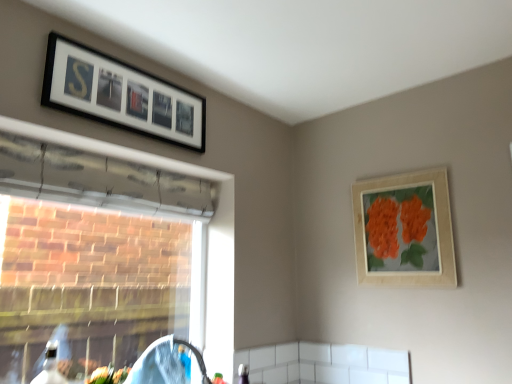
This screenshot has width=512, height=384. Describe the element at coordinates (207, 234) in the screenshot. I see `transparent plastic window at left` at that location.

What do you see at coordinates (120, 95) in the screenshot? This screenshot has height=384, width=512. I see `black matte picture frame at upper left, which ranks as the first picture frame in top-to-bottom order` at bounding box center [120, 95].

You are a GUI agent. You are given a task and a screenshot of the screen. Output one action in this format:
    pyautogui.click(x=<x>, y=<y>)
    Task: Click on the wooden picture frame at upper right, which is the 1th picture frame in bottom-to-top order
    This screenshot has height=384, width=512.
    Given the screenshot: What is the action you would take?
    pyautogui.click(x=404, y=229)

Which is behind, transparent plastic window at left or black matte picture frame at upper left, which ranks as the first picture frame in top-to-bottom order?

Positioned behind is black matte picture frame at upper left, which ranks as the first picture frame in top-to-bottom order.

Is point (131, 152) less distant than point (95, 92)?

That is False.

What are the coordinates of `window on the left of black matte picture frame at upper left, the second picture frame in the right-to-left sequence` in the screenshot? It's located at (207, 234).

Does transparent plastic window at left have a greater width compared to black matte picture frame at upper left, the 2th picture frame positioned from the bottom?

Correct, the width of transparent plastic window at left exceeds that of black matte picture frame at upper left, the 2th picture frame positioned from the bottom.

Can you confirm if wooden picture frame at upper right, which appears as the first picture frame when viewed from the right, is positioned to the right of transparent plastic window at left?

Indeed, wooden picture frame at upper right, which appears as the first picture frame when viewed from the right, is positioned on the right side of transparent plastic window at left.

Looking at this image, from a real-world perspective, is wooden picture frame at upper right, which is the 1th picture frame in bottom-to-top order, physically below transparent plastic window at left?

Actually, wooden picture frame at upper right, which is the 1th picture frame in bottom-to-top order, is physically above transparent plastic window at left in the real world.

Does wooden picture frame at upper right, which appears as the first picture frame when viewed from the right, have a greater height compared to transparent plastic window at left?

Incorrect, the height of wooden picture frame at upper right, which appears as the first picture frame when viewed from the right, is not larger of that of transparent plastic window at left.

This screenshot has height=384, width=512. What are the coordinates of `picture frame lying below the black matte picture frame at upper left, the second picture frame in the right-to-left sequence (from the image's perspective)` in the screenshot? It's located at (404, 229).

Based on their positions, is wooden picture frame at upper right, the 2th picture frame positioned from the left, located to the left or right of black matte picture frame at upper left, the second picture frame in the right-to-left sequence?

Based on their positions, wooden picture frame at upper right, the 2th picture frame positioned from the left, is located to the right of black matte picture frame at upper left, the second picture frame in the right-to-left sequence.

Does point (433, 176) lie behind point (48, 60)?

Yes, it is behind point (48, 60).

Which is in front, wooden picture frame at upper right, the 2th picture frame positioned from the left, or black matte picture frame at upper left, the 1th picture frame positioned from the left?

black matte picture frame at upper left, the 1th picture frame positioned from the left.

Choose the correct answer: Is transparent plastic window at left inside wooden picture frame at upper right, the 2th picture frame positioned from the left, or outside it?

transparent plastic window at left is not enclosed by wooden picture frame at upper right, the 2th picture frame positioned from the left.

From a real-world perspective, is transparent plastic window at left physically below wooden picture frame at upper right, which is the 1th picture frame in bottom-to-top order?

Indeed, from a real-world perspective, transparent plastic window at left is positioned beneath wooden picture frame at upper right, which is the 1th picture frame in bottom-to-top order.

Considering the points (232, 218) and (382, 255), which point is in front, point (232, 218) or point (382, 255)?

The point (382, 255) is more forward.

From the image's perspective, which is above, transparent plastic window at left or wooden picture frame at upper right, which is counted as the 2th picture frame, starting from the top?

From the image's view, wooden picture frame at upper right, which is counted as the 2th picture frame, starting from the top, is above.

From a real-world perspective, is black matte picture frame at upper left, the 2th picture frame positioned from the bottom, positioned over transparent plastic window at left based on gravity?

Yes, from a real-world perspective, black matte picture frame at upper left, the 2th picture frame positioned from the bottom, is above transparent plastic window at left.

Who is bigger, black matte picture frame at upper left, which ranks as the first picture frame in top-to-bottom order, or transparent plastic window at left?

transparent plastic window at left is bigger.

Which object is positioned more to the left, black matte picture frame at upper left, the second picture frame in the right-to-left sequence, or transparent plastic window at left?

transparent plastic window at left is more to the left.

Which is further, (x=124, y=121) or (x=401, y=280)?

Point (x=401, y=280)

How different are the orientations of black matte picture frame at upper left, the 1th picture frame positioned from the left, and wooden picture frame at upper right, which is counted as the 2th picture frame, starting from the top, in degrees?

The facing directions of black matte picture frame at upper left, the 1th picture frame positioned from the left, and wooden picture frame at upper right, which is counted as the 2th picture frame, starting from the top, are 89.4 degrees apart.

Who is taller, black matte picture frame at upper left, the second picture frame in the right-to-left sequence, or wooden picture frame at upper right, which appears as the first picture frame when viewed from the right?

With more height is wooden picture frame at upper right, which appears as the first picture frame when viewed from the right.

The width and height of the screenshot is (512, 384). What are the coordinates of `window that appears below the black matte picture frame at upper left, the 2th picture frame positioned from the bottom (from a real-world perspective)` in the screenshot? It's located at (207, 234).

Locate an element on the screen. The width and height of the screenshot is (512, 384). window lying below the wooden picture frame at upper right, which is the 1th picture frame in bottom-to-top order (from the image's perspective) is located at coordinates (207, 234).

When comparing their distances from transparent plastic window at left, does wooden picture frame at upper right, which is the 1th picture frame in bottom-to-top order, or black matte picture frame at upper left, the 2th picture frame positioned from the bottom, seem closer?

Based on the image, black matte picture frame at upper left, the 2th picture frame positioned from the bottom, appears to be nearer to transparent plastic window at left.

Estimate the real-world distances between objects in this image. Which object is further from wooden picture frame at upper right, which appears as the first picture frame when viewed from the right, black matte picture frame at upper left, the second picture frame in the right-to-left sequence, or transparent plastic window at left?

black matte picture frame at upper left, the second picture frame in the right-to-left sequence, is positioned further to the anchor wooden picture frame at upper right, which appears as the first picture frame when viewed from the right.

Looking at the image, which one is located further to wooden picture frame at upper right, which appears as the first picture frame when viewed from the right, transparent plastic window at left or black matte picture frame at upper left, the second picture frame in the right-to-left sequence?

The object further to wooden picture frame at upper right, which appears as the first picture frame when viewed from the right, is black matte picture frame at upper left, the second picture frame in the right-to-left sequence.

Considering their positions, is black matte picture frame at upper left, which ranks as the first picture frame in top-to-bottom order, positioned closer to transparent plastic window at left than wooden picture frame at upper right, which is the 1th picture frame in bottom-to-top order?

black matte picture frame at upper left, which ranks as the first picture frame in top-to-bottom order, is positioned closer to the anchor transparent plastic window at left.

When comparing their distances from black matte picture frame at upper left, the 2th picture frame positioned from the bottom, does transparent plastic window at left or wooden picture frame at upper right, which appears as the first picture frame when viewed from the right, seem closer?

transparent plastic window at left is closer to black matte picture frame at upper left, the 2th picture frame positioned from the bottom.

Estimate the real-world distances between objects in this image. Which object is closer to black matte picture frame at upper left, the 1th picture frame positioned from the left, wooden picture frame at upper right, which is the 1th picture frame in bottom-to-top order, or transparent plastic window at left?

The object closer to black matte picture frame at upper left, the 1th picture frame positioned from the left, is transparent plastic window at left.

The image size is (512, 384). In order to click on picture frame between transparent plastic window at left and wooden picture frame at upper right, which appears as the first picture frame when viewed from the right, from left to right in this screenshot , I will do `click(120, 95)`.